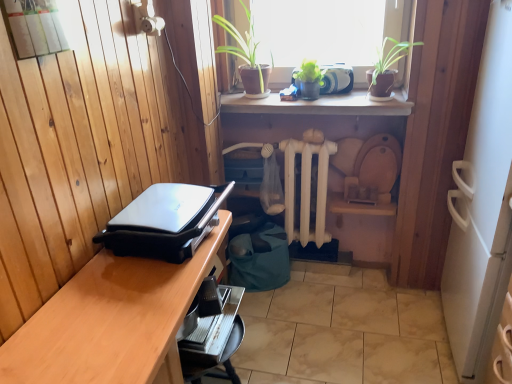
Where is `vacant area in front of black plastic grill at left`? Image resolution: width=512 pixels, height=384 pixels. vacant area in front of black plastic grill at left is located at coordinates (117, 309).